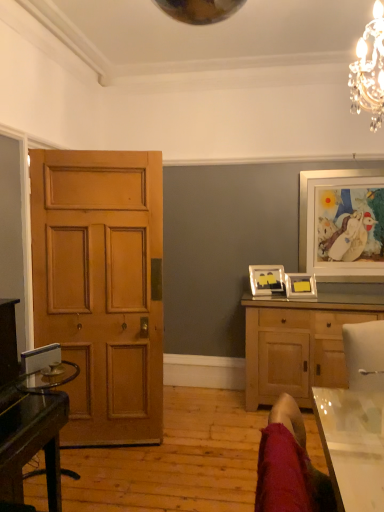
Question: From the image's perspective, relative to glass transparent desk at left, is velvet red swivel chair at lower right above or below?

Choices:
 (A) below
 (B) above

Answer: (B)

Question: Is velvet red swivel chair at lower right wider or thinner than glass transparent desk at left?

Choices:
 (A) thin
 (B) wide

Answer: (A)

Question: Based on their relative distances, which object is farther from the wooden cabinet at right?

Choices:
 (A) transparent glass table at lower right
 (B) velvet red swivel chair at lower right
 (C) light brown wooden door at left
 (D) white glossy picture frame at upper right, the third picture frame viewed from the left
 (E) metallic silver picture frame at center-right, the second picture frame in the left-to-right sequence

Answer: (B)

Question: Based on their relative distances, which object is nearer to the white glossy picture frame at upper right, the third picture frame viewed from the left?

Choices:
 (A) wooden cabinet at right
 (B) light brown wooden door at left
 (C) matte black picture frame at center-right, acting as the third picture frame starting from the right
 (D) metallic silver picture frame at center-right, the 2th picture frame when ordered from right to left
 (E) glass transparent desk at left

Answer: (D)